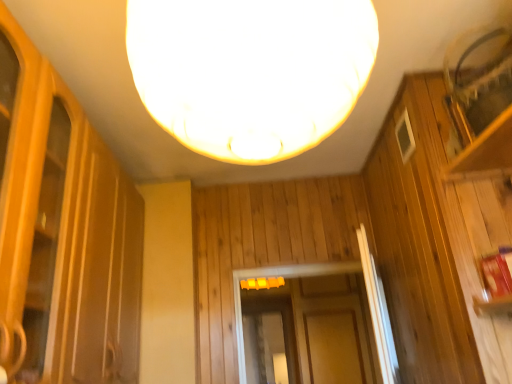
Question: Is white matte lampshade at center bigger than transparent glass screen door at center?

Choices:
 (A) yes
 (B) no

Answer: (A)

Question: From a real-world perspective, is white matte lampshade at center physically above transparent glass screen door at center?

Choices:
 (A) yes
 (B) no

Answer: (A)

Question: Is white matte lampshade at center behind transparent glass screen door at center?

Choices:
 (A) no
 (B) yes

Answer: (A)

Question: Can you confirm if white matte lampshade at center is positioned to the right of transparent glass screen door at center?

Choices:
 (A) no
 (B) yes

Answer: (A)

Question: Is white matte lampshade at center next to transparent glass screen door at center and touching it?

Choices:
 (A) yes
 (B) no

Answer: (B)

Question: Is there a large distance between white matte lampshade at center and transparent glass screen door at center?

Choices:
 (A) no
 (B) yes

Answer: (B)

Question: Is white matte lampshade at center at the back of transparent glass screen door at center?

Choices:
 (A) yes
 (B) no

Answer: (B)

Question: Is transparent glass screen door at center positioned behind white matte lampshade at center?

Choices:
 (A) no
 (B) yes

Answer: (B)

Question: From the image's perspective, does transparent glass screen door at center appear lower than white matte lampshade at center?

Choices:
 (A) no
 (B) yes

Answer: (B)

Question: From the image's perspective, does transparent glass screen door at center appear higher than white matte lampshade at center?

Choices:
 (A) yes
 (B) no

Answer: (B)

Question: Is transparent glass screen door at center at the left side of white matte lampshade at center?

Choices:
 (A) no
 (B) yes

Answer: (A)

Question: Considering the relative sizes of transparent glass screen door at center and white matte lampshade at center in the image provided, is transparent glass screen door at center taller than white matte lampshade at center?

Choices:
 (A) no
 (B) yes

Answer: (B)

Question: In terms of size, does transparent glass screen door at center appear bigger or smaller than white matte lampshade at center?

Choices:
 (A) small
 (B) big

Answer: (A)